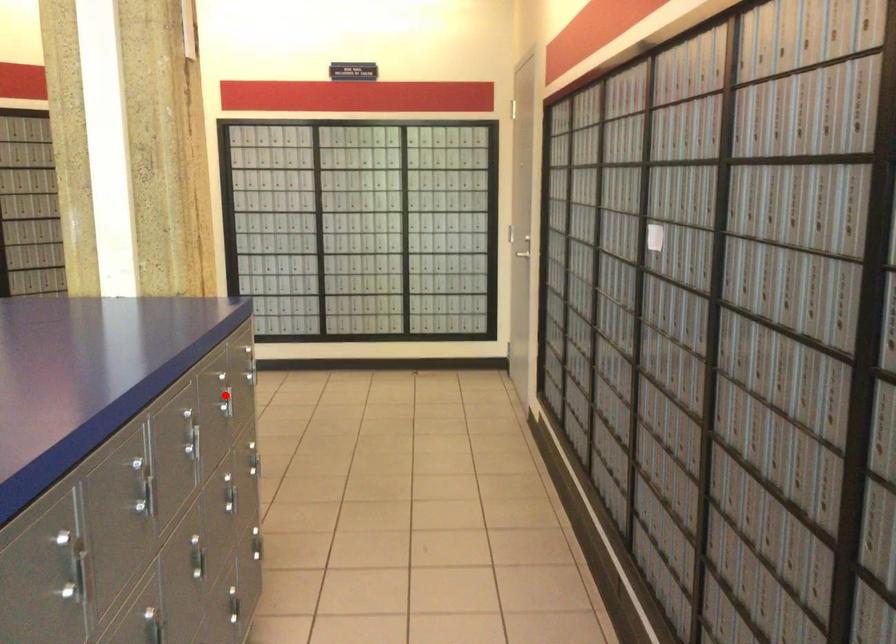
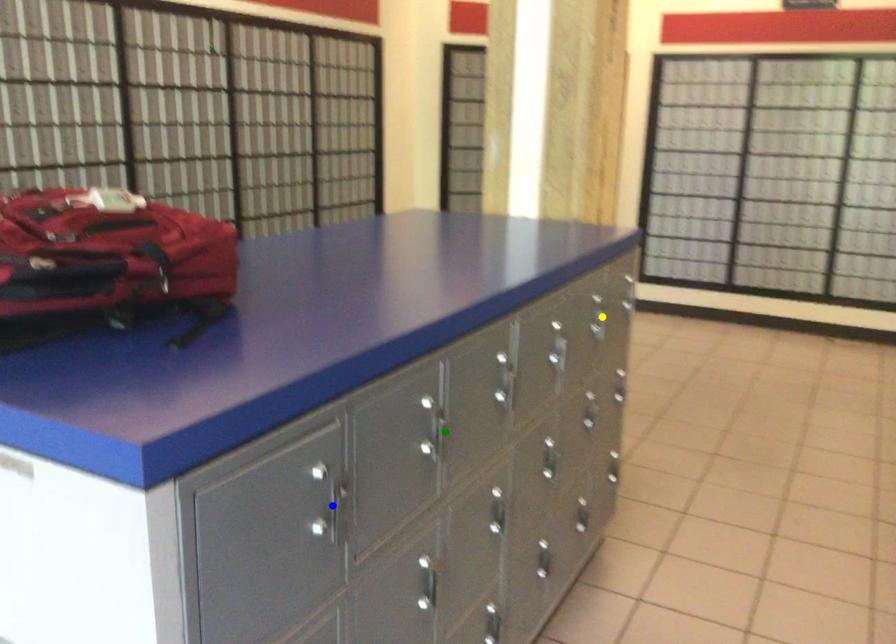
Question: I am providing you with two images of the same scene from different viewpoints. A red point is marked on the first image. You are given multiple points on the second image. Which point in image 2 is actually the same real-world point as the red point in image 1?

Choices:
 (A) green point
 (B) blue point
 (C) yellow point

Answer: (C)